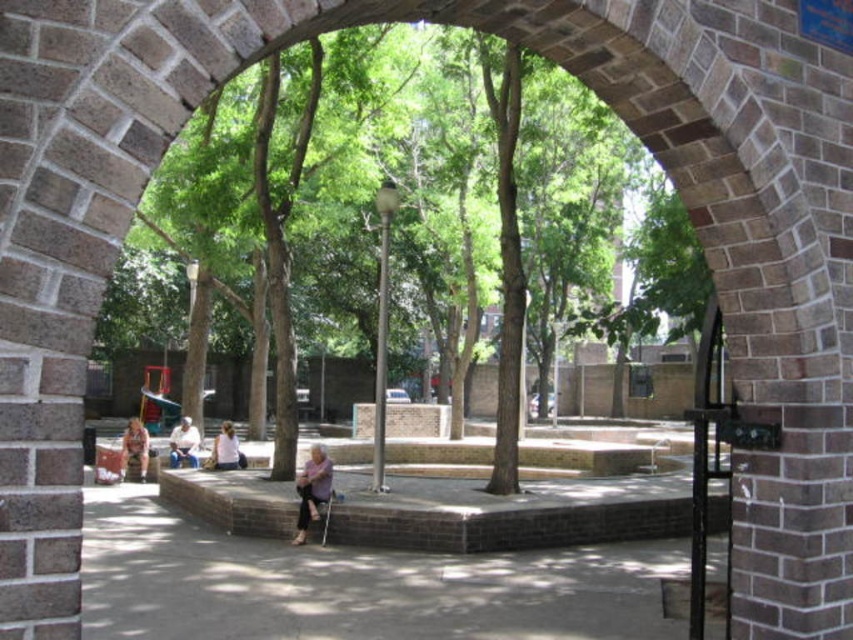
You are standing at the entrance of the arched brick structure and want to place a new decorative item exactly where the purple fabric at center is currently located. According to the scene description, where should you place the new item?

You should place the new item at the point with coordinates 0.766 on the x axis and 0.367 on the y axis, as this matches the 2D location of the purple fabric at center.

You are standing at the entrance of the arched brick structure and see both the brown leather jacket at lower left and the light brown leather jacket at center. Which jacket is closer to you?

The brown leather jacket at lower left is closer to you because it is in front of the light brown leather jacket at center.